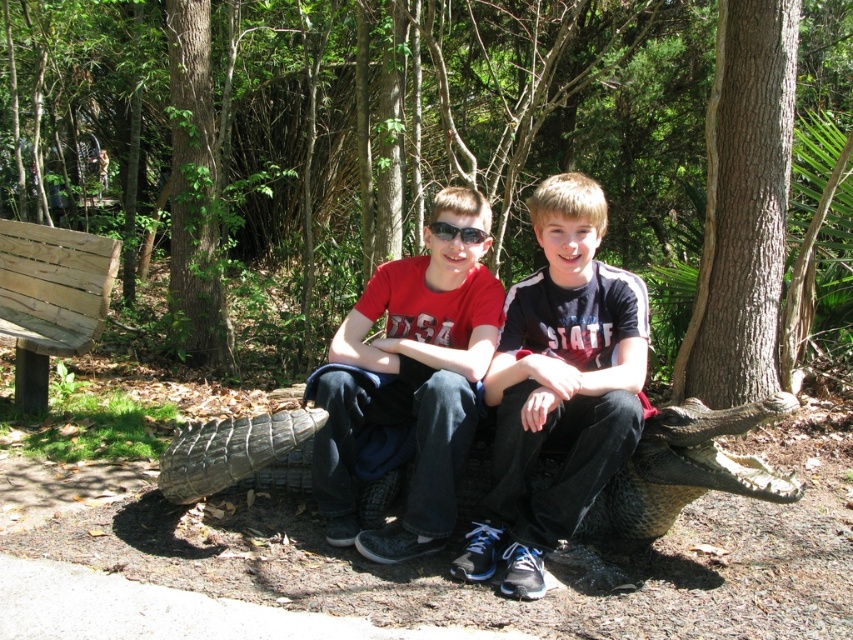
Question: Is green textured tree at center below brown rough tree trunk at right?

Choices:
 (A) yes
 (B) no

Answer: (B)

Question: Considering the real-world distances, which object is closest to the black plastic sunglasses at center?

Choices:
 (A) green textured tree at center
 (B) matte black shirt at center

Answer: (B)

Question: Which of the following is the farthest from the observer?

Choices:
 (A) (773, 33)
 (B) (206, 172)

Answer: (B)

Question: Which object is positioned closest to the green textured tree at center?

Choices:
 (A) brown rough tree trunk at right
 (B) green rough bark tree trunk at upper left
 (C) matte black shirt at center
 (D) black plastic sunglasses at center

Answer: (B)

Question: Is the position of matte black shirt at center less distant than that of black plastic sunglasses at center?

Choices:
 (A) yes
 (B) no

Answer: (A)

Question: Is matte red t-shirt at center thinner than black plastic sunglasses at center?

Choices:
 (A) no
 (B) yes

Answer: (A)